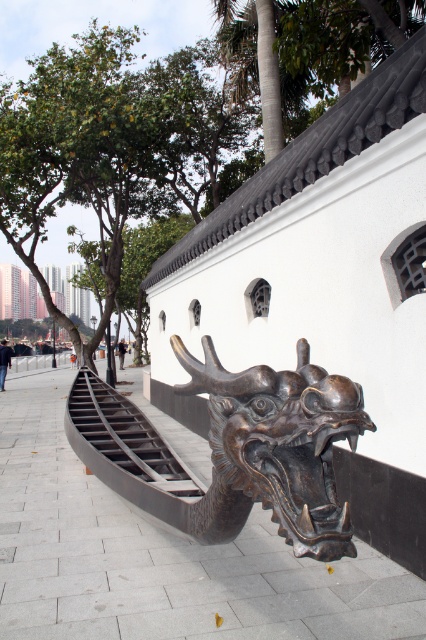
The image size is (426, 640). Describe the element at coordinates (100, 20) in the screenshot. I see `green leafy tree at upper left` at that location.

Who is lower down, green leafy tree at upper left or black matte stair at lower left?

Positioned lower is black matte stair at lower left.

Is point (173, 38) farther from camera compared to point (190, 492)?

Yes, it is behind point (190, 492).

Image resolution: width=426 pixels, height=640 pixels. In order to click on green leafy tree at upper left in this screenshot , I will do `click(100, 20)`.

Between bronze/sculpture at center and black matte stair at lower left, which one appears on the right side from the viewer's perspective?

Positioned to the right is bronze/sculpture at center.

Who is taller, bronze/sculpture at center or black matte stair at lower left?

Standing taller between the two is bronze/sculpture at center.

I want to click on bronze/sculpture at center, so click(x=282, y=442).

Does bronze/sculpture at center have a greater width compared to green leafy tree at upper left?

In fact, bronze/sculpture at center might be narrower than green leafy tree at upper left.

Which is above, bronze/sculpture at center or green leafy tree at upper left?

green leafy tree at upper left

Where is `bronze/sculpture at center`? The image size is (426, 640). bronze/sculpture at center is located at coordinates 282,442.